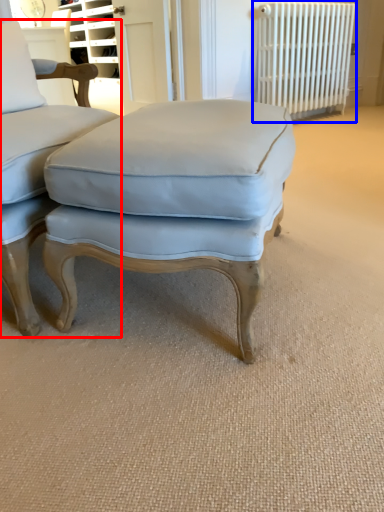
Question: Which object appears farthest to the camera in this image, chair (highlighted by a red box) or radiator (highlighted by a blue box)?

Choices:
 (A) chair
 (B) radiator

Answer: (B)